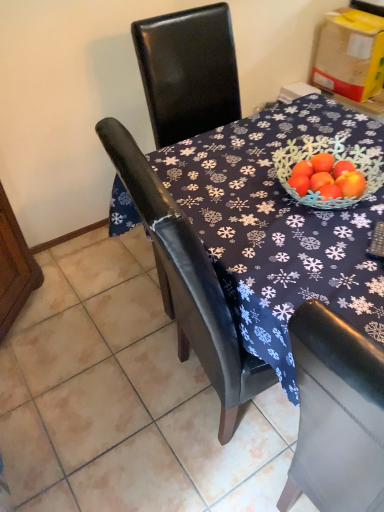
Question: Considering the relative positions of matte black chair at center and yellow cardboard box at upper right in the image provided, is matte black chair at center to the left of yellow cardboard box at upper right from the viewer's perspective?

Choices:
 (A) yes
 (B) no

Answer: (A)

Question: Is matte black chair at center not inside yellow cardboard box at upper right?

Choices:
 (A) no
 (B) yes

Answer: (B)

Question: From a real-world perspective, does matte black chair at center stand above yellow cardboard box at upper right?

Choices:
 (A) no
 (B) yes

Answer: (A)

Question: Considering the relative sizes of matte black chair at center and yellow cardboard box at upper right in the image provided, is matte black chair at center taller than yellow cardboard box at upper right?

Choices:
 (A) no
 (B) yes

Answer: (A)

Question: Is matte black chair at center facing towards yellow cardboard box at upper right?

Choices:
 (A) yes
 (B) no

Answer: (B)

Question: Can you confirm if matte black chair at center is smaller than yellow cardboard box at upper right?

Choices:
 (A) no
 (B) yes

Answer: (A)

Question: Would you say yellow cardboard box at upper right contains matte black chair at center?

Choices:
 (A) no
 (B) yes

Answer: (A)

Question: From the image's perspective, would you say yellow cardboard box at upper right is shown under matte black chair at center?

Choices:
 (A) no
 (B) yes

Answer: (A)

Question: From a real-world perspective, is yellow cardboard box at upper right physically above matte black chair at center?

Choices:
 (A) no
 (B) yes

Answer: (B)

Question: Is yellow cardboard box at upper right further to the viewer compared to matte black chair at center?

Choices:
 (A) yes
 (B) no

Answer: (A)

Question: Does yellow cardboard box at upper right lie in front of matte black chair at center?

Choices:
 (A) yes
 (B) no

Answer: (B)

Question: Can you confirm if yellow cardboard box at upper right is shorter than matte black chair at center?

Choices:
 (A) no
 (B) yes

Answer: (A)

Question: Based on their positions, is matte black chair at center located to the left or right of yellow cardboard box at upper right?

Choices:
 (A) right
 (B) left

Answer: (B)